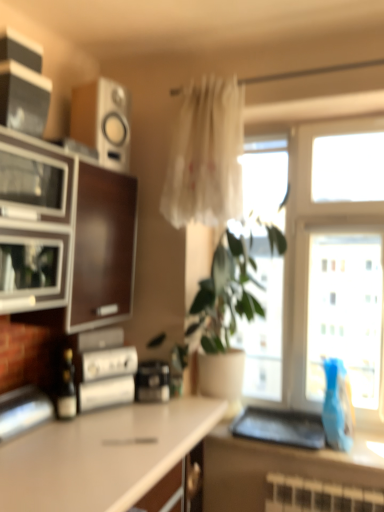
Where is `free space in front of matte glass bottle at center`? This screenshot has width=384, height=512. free space in front of matte glass bottle at center is located at coordinates (41, 435).